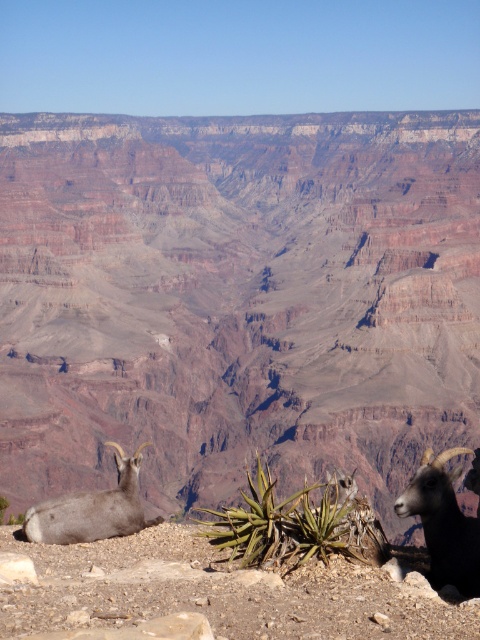
Can you confirm if gray rocky hillside at lower center is wider than gray woolen goat at lower left?

Yes.

I want to click on gray rocky hillside at lower center, so click(x=236, y=298).

Is point (434, 291) positioned behind point (101, 512)?

That is True.

At what (x,y) coordinates should I click in order to perform the action: click on gray rocky hillside at lower center. Please return your answer as a coordinate pair (x, y). Looking at the image, I should click on (236, 298).

Can you confirm if black woolly goat at lower right is shorter than gray woolen goat at lower left?

Yes.

Locate an element on the screen. This screenshot has width=480, height=640. black woolly goat at lower right is located at coordinates tap(444, 522).

In the scene shown: Who is taller, gray rocky hillside at lower center or black woolly goat at lower right?

gray rocky hillside at lower center

Is gray rocky hillside at lower center wider than black woolly goat at lower right?

Indeed, gray rocky hillside at lower center has a greater width compared to black woolly goat at lower right.

Is point (88, 397) more distant than point (421, 524)?

Yes, point (88, 397) is behind point (421, 524).

The height and width of the screenshot is (640, 480). I want to click on gray rocky hillside at lower center, so click(236, 298).